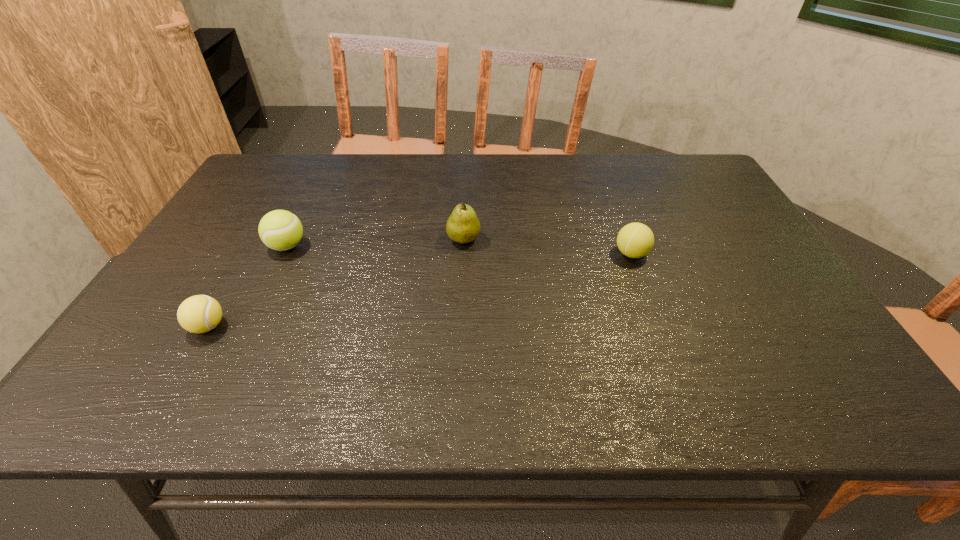
This screenshot has height=540, width=960. Find the location of `the tallest object`. the tallest object is located at coordinates (463, 226).

Find the location of a particular element. pear is located at coordinates (463, 226).

Locate an element on the screen. the tallest tennis ball is located at coordinates (281, 230).

Where is `the rightmost object`? the rightmost object is located at coordinates (635, 240).

Where is `the nearest object`? Image resolution: width=960 pixels, height=540 pixels. the nearest object is located at coordinates (198, 314).

Locate an element on the screen. The height and width of the screenshot is (540, 960). vacant area situated 0.360m on the back of the tallest object is located at coordinates (467, 165).

Where is `vacant space positioned on the back of the tallest tennis ball`? vacant space positioned on the back of the tallest tennis ball is located at coordinates (301, 217).

I want to click on vacant region located 0.190m on the left of the rightmost object, so click(543, 254).

What are the coordinates of `vacant space situated 0.390m on the back of the nearest tennis ball` in the screenshot? It's located at (273, 214).

Locate an element on the screen. This screenshot has width=960, height=540. object present at the left edge is located at coordinates (198, 314).